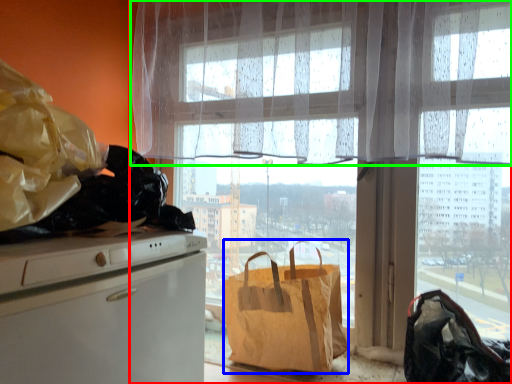
Question: Based on their relative distances, which object is nearer to window (highlighted by a red box)? Choose from handbag (highlighted by a blue box) and curtain (highlighted by a green box).

Choices:
 (A) handbag
 (B) curtain

Answer: (B)